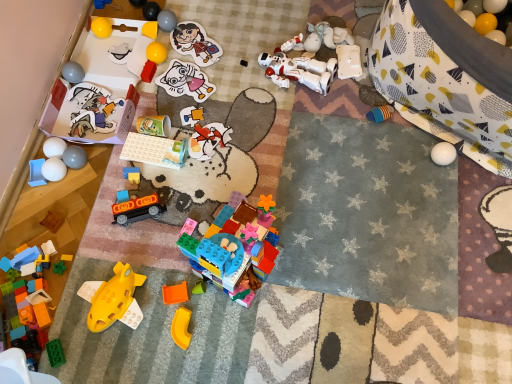
In order to click on empty space that is to the right of matte cardboard cutout at upper left, which is counted as the 15th toy, starting from the right in this screenshot , I will do `click(154, 102)`.